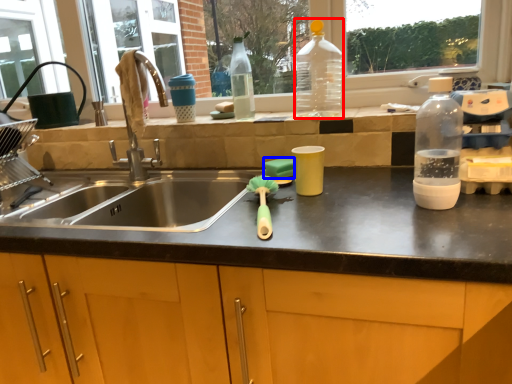
Question: Which object appears farthest to the camera in this image, bottle (highlighted by a red box) or soap (highlighted by a blue box)?

Choices:
 (A) bottle
 (B) soap

Answer: (B)